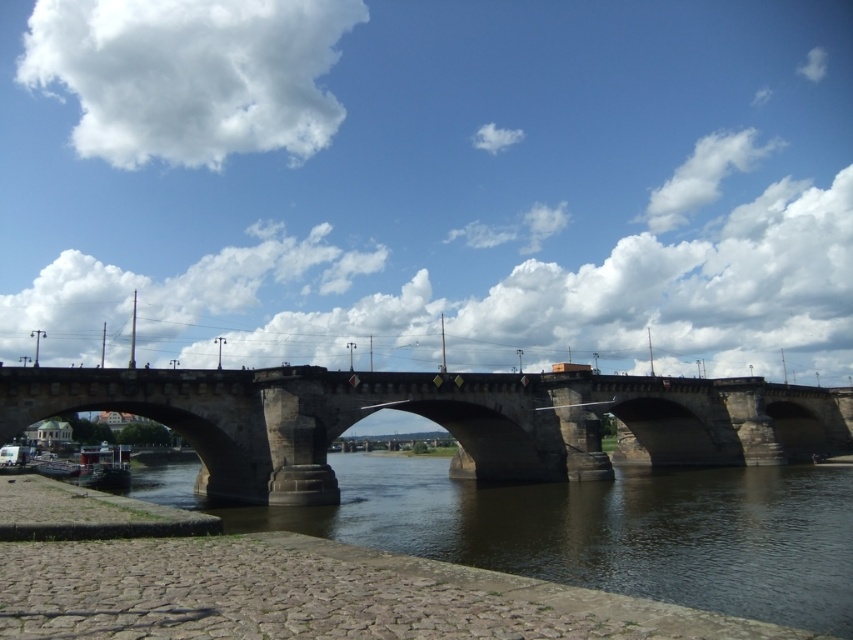
Question: Is white fluffy cloud at upper left bigger than white fluffy cloud at upper center?

Choices:
 (A) yes
 (B) no

Answer: (A)

Question: Which object is farther from the camera taking this photo?

Choices:
 (A) white fluffy cloud at upper right
 (B) stone bridge at center
 (C) brown stone river at lower left
 (D) white fluffy cloud at upper center

Answer: (A)

Question: Which is nearer to the stone bridge at center?

Choices:
 (A) metallic gray boat at lower left
 (B) white fluffy cloud at upper right
 (C) brown stone river at lower left

Answer: (C)

Question: Among these points, which one is farthest from the camera?

Choices:
 (A) (697, 148)
 (B) (515, 380)
 (C) (97, 476)
 (D) (157, 132)

Answer: (A)

Question: Does brown stone river at lower left lie behind white fluffy cloud at upper left?

Choices:
 (A) no
 (B) yes

Answer: (A)

Question: Can you confirm if white fluffy cloud at upper left is positioned to the left of metallic gray boat at lower left?

Choices:
 (A) no
 (B) yes

Answer: (B)